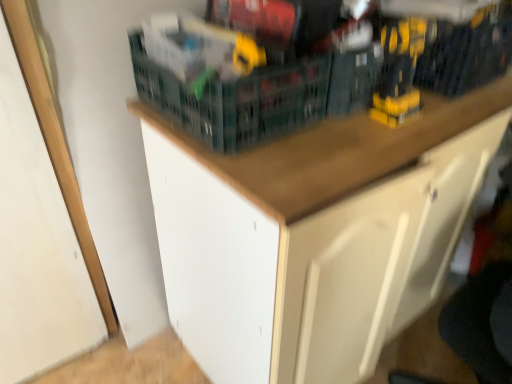
Identify the location of white matte drawer at lower right. (446, 215).

What do you see at coordinates (257, 96) in the screenshot? I see `green plastic basket at upper center` at bounding box center [257, 96].

Image resolution: width=512 pixels, height=384 pixels. Identify the location of yellow plastic drill at upper right, the 1th toy viewed from the right. (400, 70).

Find the location of a particular element. This screenshot has height=384, width=512. white matte drawer at lower right is located at coordinates (446, 215).

Is point (505, 108) behind point (242, 46)?

Yes, point (505, 108) is farther from viewer.

Between wooden cabinet at upper center and yellow plastic drill at upper center, the second toy positioned from the right, which one has more height?

Standing taller between the two is wooden cabinet at upper center.

Based on their positions, is wooden cabinet at upper center located to the left or right of yellow plastic drill at upper center, the second toy positioned from the right?

In the image, wooden cabinet at upper center appears on the right side of yellow plastic drill at upper center, the second toy positioned from the right.

Considering the sizes of objects yellow plastic drill at upper center, placed as the first toy when sorted from left to right, and yellow plastic drill at upper right, positioned as the second toy in left-to-right order, in the image provided, who is smaller, yellow plastic drill at upper center, placed as the first toy when sorted from left to right, or yellow plastic drill at upper right, positioned as the second toy in left-to-right order,?

Smaller between the two is yellow plastic drill at upper center, placed as the first toy when sorted from left to right.

In terms of height, does yellow plastic drill at upper center, the second toy positioned from the right, look taller or shorter compared to yellow plastic drill at upper right, positioned as the second toy in left-to-right order?

In the image, yellow plastic drill at upper center, the second toy positioned from the right, appears to be shorter than yellow plastic drill at upper right, positioned as the second toy in left-to-right order.

From the image's perspective, is yellow plastic drill at upper center, the second toy positioned from the right, on yellow plastic drill at upper right, positioned as the second toy in left-to-right order?

Correct, yellow plastic drill at upper center, the second toy positioned from the right, appears higher than yellow plastic drill at upper right, positioned as the second toy in left-to-right order, in the image.

Where is `cabinetry lying on the left of yellow plastic drill at upper right, positioned as the second toy in left-to-right order`? This screenshot has height=384, width=512. cabinetry lying on the left of yellow plastic drill at upper right, positioned as the second toy in left-to-right order is located at coordinates (315, 235).

From a real-world perspective, is wooden cabinet at upper center under yellow plastic drill at upper right, the 1th toy viewed from the right?

Correct, in the physical world, wooden cabinet at upper center is lower than yellow plastic drill at upper right, the 1th toy viewed from the right.

Does point (345, 370) come behind point (394, 41)?

That is True.

From the image's perspective, is wooden cabinet at upper center above or below yellow plastic drill at upper right, positioned as the second toy in left-to-right order?

Based on their image positions, wooden cabinet at upper center is located beneath yellow plastic drill at upper right, positioned as the second toy in left-to-right order.

Is green plastic basket at upper center wider than wooden cabinet at upper center?

No, green plastic basket at upper center is not wider than wooden cabinet at upper center.

Who is smaller, green plastic basket at upper center or wooden cabinet at upper center?

Smaller between the two is green plastic basket at upper center.

From a real-world perspective, is green plastic basket at upper center physically below wooden cabinet at upper center?

Incorrect, from a real-world perspective, green plastic basket at upper center is higher than wooden cabinet at upper center.

Does green plastic basket at upper center have a greater width compared to yellow plastic drill at upper right, positioned as the second toy in left-to-right order?

Yes.

Consider the image. Considering the sizes of objects green plastic basket at upper center and yellow plastic drill at upper right, the 1th toy viewed from the right, in the image provided, who is shorter, green plastic basket at upper center or yellow plastic drill at upper right, the 1th toy viewed from the right,?

green plastic basket at upper center.

Is green plastic basket at upper center not near yellow plastic drill at upper right, positioned as the second toy in left-to-right order?

They are positioned close to each other.

Considering the relative sizes of green plastic basket at upper center and yellow plastic drill at upper right, the 1th toy viewed from the right, in the image provided, is green plastic basket at upper center bigger than yellow plastic drill at upper right, the 1th toy viewed from the right,?

Indeed, green plastic basket at upper center has a larger size compared to yellow plastic drill at upper right, the 1th toy viewed from the right.

Is white matte drawer at lower right shorter than wooden cabinet at upper center?

Indeed, white matte drawer at lower right has a lesser height compared to wooden cabinet at upper center.

Does white matte drawer at lower right appear on the left side of wooden cabinet at upper center?

Incorrect, white matte drawer at lower right is not on the left side of wooden cabinet at upper center.

Which is less distant, (389, 340) or (315, 236)?

Point (389, 340) is farther from the camera than point (315, 236).

Looking at their sizes, would you say white matte drawer at lower right is wider or thinner than wooden cabinet at upper center?

In the image, white matte drawer at lower right appears to be wider than wooden cabinet at upper center.

Could you tell me if green plastic basket at upper center is facing yellow plastic drill at upper center, the second toy positioned from the right?

No.

Which of these two, green plastic basket at upper center or yellow plastic drill at upper center, the second toy positioned from the right, is bigger?

green plastic basket at upper center.

This screenshot has height=384, width=512. Identify the location of cabinetry below the yellow plastic drill at upper center, the second toy positioned from the right (from a real-world perspective). (315, 235).

You are a GUI agent. You are given a task and a screenshot of the screen. Output one action in this format:
    pyautogui.click(x=<x>, y=<y>)
    Task: Click on the toy above the yellow plastic drill at upper right, the 1th toy viewed from the right (from a real-world perspective)
    
    Given the screenshot: What is the action you would take?
    pyautogui.click(x=225, y=48)

From the image, which object appears to be nearer to white matte drawer at lower right, wooden cabinet at upper center or yellow plastic drill at upper center, the second toy positioned from the right?

Among the two, wooden cabinet at upper center is located nearer to white matte drawer at lower right.

From the image, which object appears to be nearer to white matte drawer at lower right, yellow plastic drill at upper center, placed as the first toy when sorted from left to right, or wooden cabinet at upper center?

wooden cabinet at upper center is positioned closer to the anchor white matte drawer at lower right.

Which object lies nearer to the anchor point green plastic basket at upper center, yellow plastic drill at upper center, the second toy positioned from the right, or yellow plastic drill at upper right, positioned as the second toy in left-to-right order?

Among the two, yellow plastic drill at upper center, the second toy positioned from the right, is located nearer to green plastic basket at upper center.

From the image, which object appears to be nearer to white matte drawer at lower right, yellow plastic drill at upper right, positioned as the second toy in left-to-right order, or wooden cabinet at upper center?

wooden cabinet at upper center is closer to white matte drawer at lower right.

Consider the image. Considering their positions, is white matte drawer at lower right positioned further to yellow plastic drill at upper center, the second toy positioned from the right, than green plastic basket at upper center?

white matte drawer at lower right is further to yellow plastic drill at upper center, the second toy positioned from the right.

When comparing their distances from yellow plastic drill at upper center, placed as the first toy when sorted from left to right, does wooden cabinet at upper center or white matte drawer at lower right seem further?

Based on the image, white matte drawer at lower right appears to be further to yellow plastic drill at upper center, placed as the first toy when sorted from left to right.

From the image, which object appears to be farther from green plastic basket at upper center, yellow plastic drill at upper right, the 1th toy viewed from the right, or white matte drawer at lower right?

white matte drawer at lower right lies further to green plastic basket at upper center than the other object.

Considering their positions, is green plastic basket at upper center positioned further to wooden cabinet at upper center than yellow plastic drill at upper right, positioned as the second toy in left-to-right order?

Based on the image, yellow plastic drill at upper right, positioned as the second toy in left-to-right order, appears to be further to wooden cabinet at upper center.

Locate an element on the screen. This screenshot has width=512, height=384. cabinetry between green plastic basket at upper center and yellow plastic drill at upper right, positioned as the second toy in left-to-right order is located at coordinates (315, 235).

This screenshot has height=384, width=512. I want to click on basket between yellow plastic drill at upper center, the second toy positioned from the right, and yellow plastic drill at upper right, the 1th toy viewed from the right, from left to right, so click(x=257, y=96).

Identify the location of basket between yellow plastic drill at upper center, the second toy positioned from the right, and wooden cabinet at upper center vertically. This screenshot has height=384, width=512. (257, 96).

Where is `cabinetry situated between yellow plastic drill at upper center, the second toy positioned from the right, and yellow plastic drill at upper right, positioned as the second toy in left-to-right order, from left to right`? The width and height of the screenshot is (512, 384). cabinetry situated between yellow plastic drill at upper center, the second toy positioned from the right, and yellow plastic drill at upper right, positioned as the second toy in left-to-right order, from left to right is located at coordinates (315, 235).